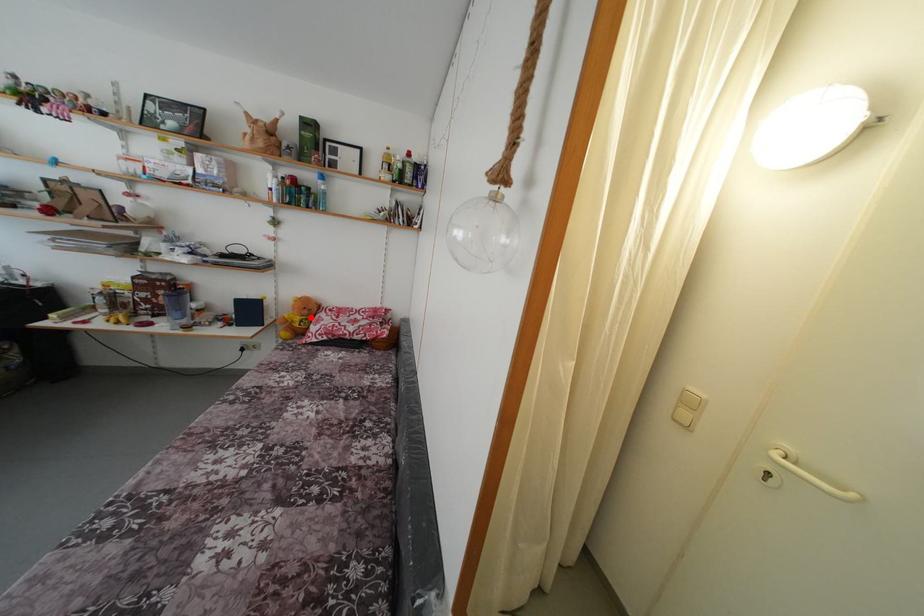
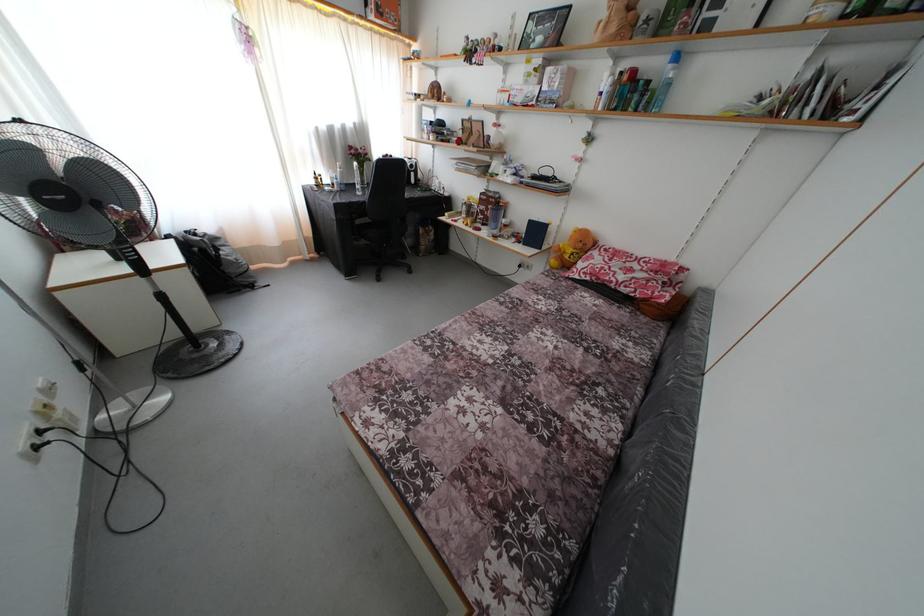
In the second image, find the point that corresponds to the highlighted location in the first image.

(585, 251)